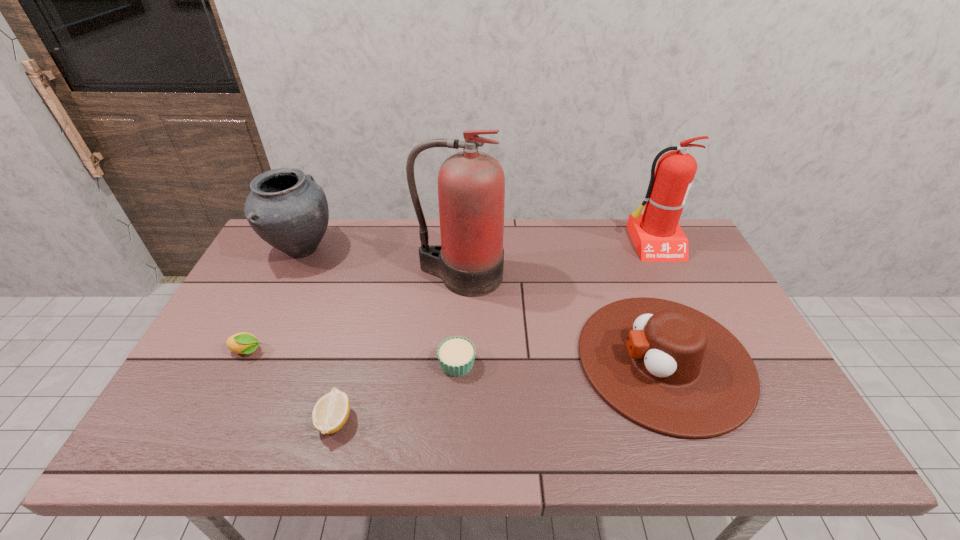
The height and width of the screenshot is (540, 960). I want to click on the taller fire extinguisher, so click(471, 184).

The width and height of the screenshot is (960, 540). Identify the location of the tallest object. (471, 184).

At what (x,y) coordinates should I click in order to perform the action: click on the sixth shortest object. Please return your answer as a coordinate pair (x, y). Looking at the image, I should click on (656, 234).

Locate an element on the screen. the shorter fire extinguisher is located at coordinates (656, 234).

Image resolution: width=960 pixels, height=540 pixels. I want to click on urn, so click(286, 208).

Find the location of a particular element. The height and width of the screenshot is (540, 960). the fourth tallest object is located at coordinates (670, 368).

Identify the location of the taller lemon. Image resolution: width=960 pixels, height=540 pixels. (242, 343).

I want to click on the left lemon, so click(242, 343).

The height and width of the screenshot is (540, 960). In order to click on cupcake in this screenshot , I will do `click(456, 355)`.

Find the location of `the nearer lemon`. the nearer lemon is located at coordinates (330, 413).